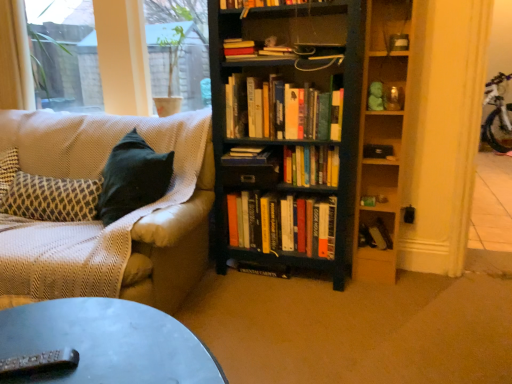
Question: Is dark wood bookcase at center positioned before metallic gray remote control at lower left?

Choices:
 (A) no
 (B) yes

Answer: (A)

Question: From a real-world perspective, is dark wood bookcase at center physically above metallic gray remote control at lower left?

Choices:
 (A) no
 (B) yes

Answer: (B)

Question: Considering the relative sizes of dark wood bookcase at center and metallic gray remote control at lower left in the image provided, is dark wood bookcase at center smaller than metallic gray remote control at lower left?

Choices:
 (A) yes
 (B) no

Answer: (B)

Question: Considering the relative sizes of dark wood bookcase at center and metallic gray remote control at lower left in the image provided, is dark wood bookcase at center shorter than metallic gray remote control at lower left?

Choices:
 (A) yes
 (B) no

Answer: (B)

Question: Is dark wood bookcase at center thinner than metallic gray remote control at lower left?

Choices:
 (A) no
 (B) yes

Answer: (A)

Question: Considering the positions of metallic gray remote control at lower left and hardcover book at center, positioned as the fourth book in bottom-to-top order, in the image, is metallic gray remote control at lower left taller or shorter than hardcover book at center, positioned as the fourth book in bottom-to-top order,?

Choices:
 (A) tall
 (B) short

Answer: (B)

Question: From a real-world perspective, is metallic gray remote control at lower left above or below hardcover book at center, positioned as the fourth book in bottom-to-top order?

Choices:
 (A) below
 (B) above

Answer: (A)

Question: Considering the positions of metallic gray remote control at lower left and hardcover book at center, acting as the third book starting from the top, in the image, is metallic gray remote control at lower left wider or thinner than hardcover book at center, acting as the third book starting from the top,?

Choices:
 (A) wide
 (B) thin

Answer: (A)

Question: Is metallic gray remote control at lower left situated inside hardcover book at center, positioned as the fourth book in bottom-to-top order, or outside?

Choices:
 (A) outside
 (B) inside

Answer: (A)

Question: From the image's perspective, is transparent glass window screen at upper left, which is the 2th window screen from left to right, above or below metallic gray remote control at lower left?

Choices:
 (A) below
 (B) above

Answer: (B)

Question: From a real-world perspective, is transparent glass window screen at upper left, which is the 2th window screen from left to right, positioned above or below metallic gray remote control at lower left?

Choices:
 (A) below
 (B) above

Answer: (B)

Question: Is transparent glass window screen at upper left, which is the 2th window screen from left to right, situated inside metallic gray remote control at lower left or outside?

Choices:
 (A) outside
 (B) inside

Answer: (A)

Question: Based on their positions, is transparent glass window screen at upper left, which is counted as the first window screen, starting from the right, located to the left or right of metallic gray remote control at lower left?

Choices:
 (A) right
 (B) left

Answer: (B)

Question: Looking at the image, does hardcover book at center, the sixth book positioned from the top, seem bigger or smaller compared to textured beige couch at left?

Choices:
 (A) small
 (B) big

Answer: (A)

Question: In the image, is hardcover book at center, which appears as the first book when ordered from the bottom, positioned in front of or behind textured beige couch at left?

Choices:
 (A) behind
 (B) front

Answer: (A)